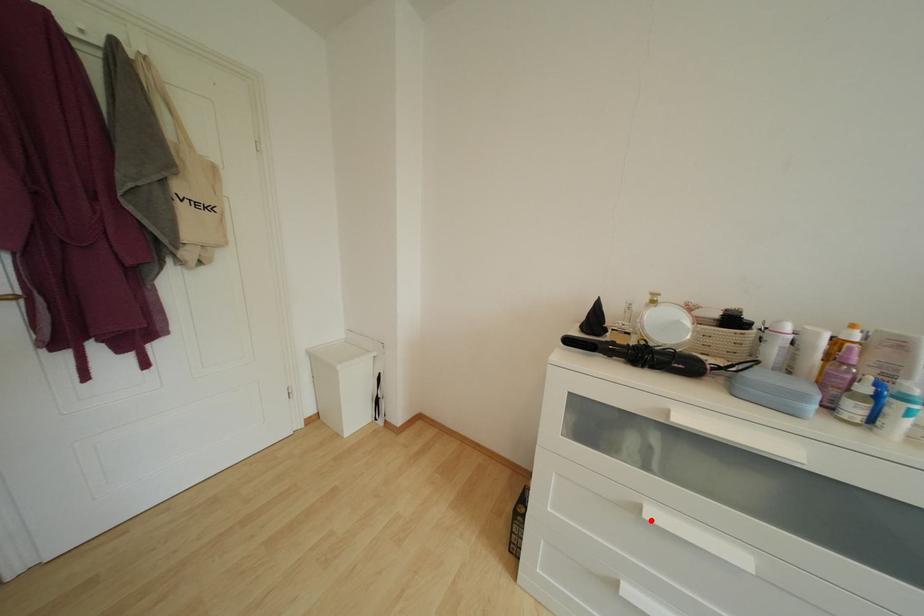
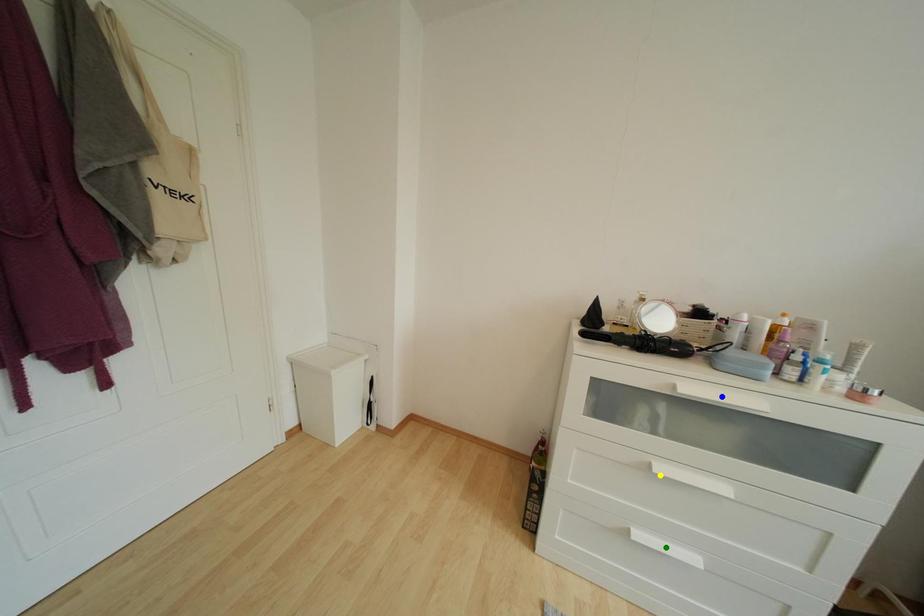
Question: I am providing you with two images of the same scene from different viewpoints. A red point is marked on the first image. You are given multiple points on the second image. Which mark in image 2 goes with the point in image 1?

Choices:
 (A) yellow point
 (B) green point
 (C) blue point

Answer: (A)